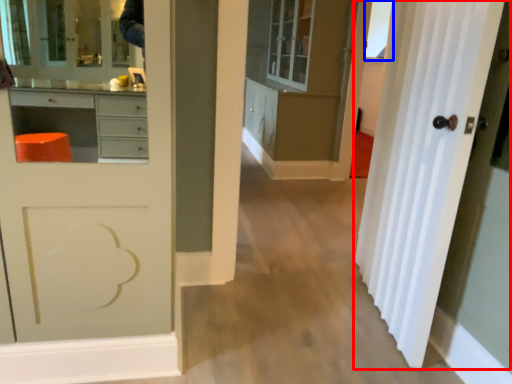
Question: Which point is closer to the camera, door (highlighted by a red box) or window (highlighted by a blue box)?

Choices:
 (A) door
 (B) window

Answer: (A)